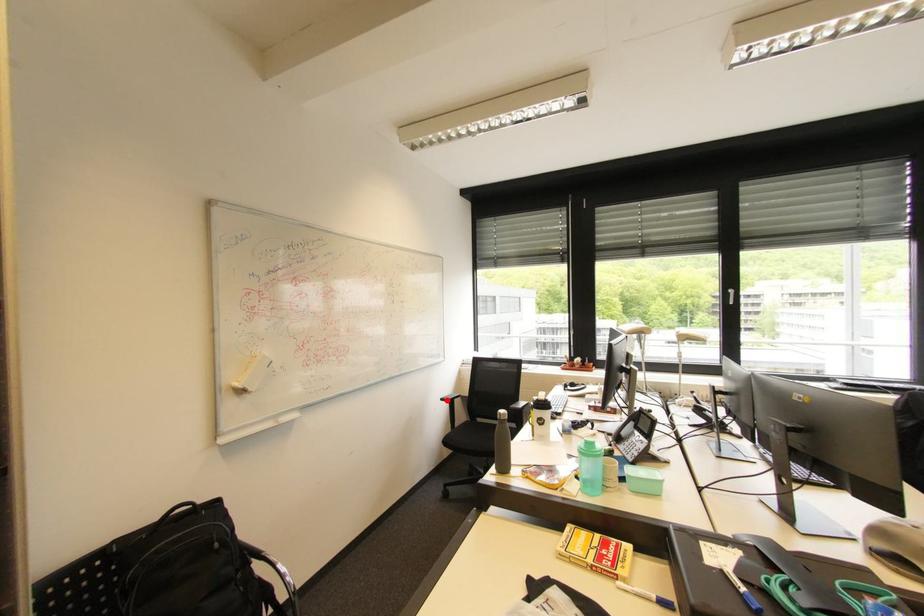
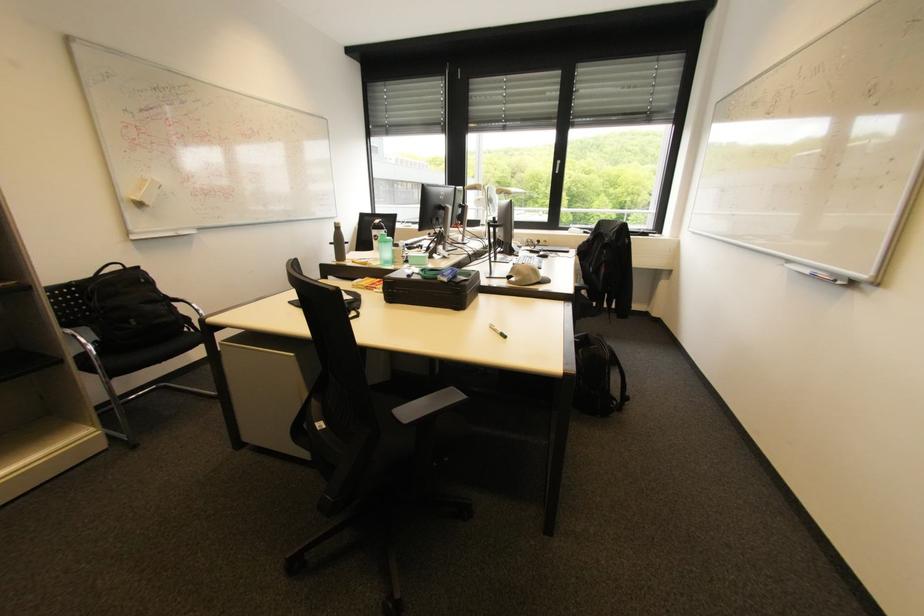
Question: I am providing you with two images of the same scene from different viewpoints. A red point is shown in image1. For the corresponding object point in image2, is it positioned nearer or farther from the camera?

Choices:
 (A) Nearer
 (B) Farther

Answer: (B)